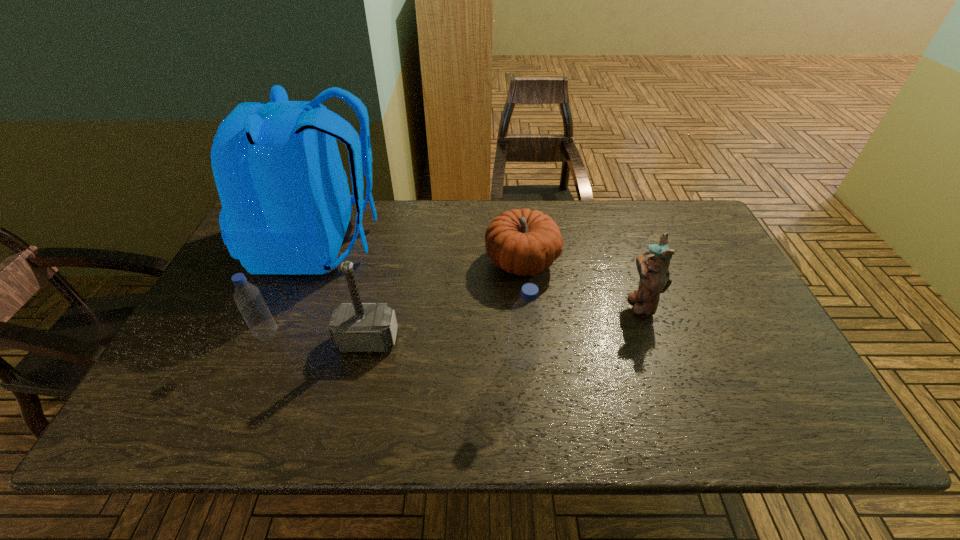
Locate an element on the screen. This screenshot has width=960, height=540. backpack situated at the left edge is located at coordinates click(x=286, y=205).

Where is `object positioned at the far left corner`? The height and width of the screenshot is (540, 960). object positioned at the far left corner is located at coordinates (286, 205).

Where is `vacant space at the far edge of the desktop`? This screenshot has width=960, height=540. vacant space at the far edge of the desktop is located at coordinates (646, 209).

In order to click on free region at the near edge of the desktop in this screenshot , I will do `click(578, 393)`.

Find the location of `free space at the far right corner`. free space at the far right corner is located at coordinates (660, 217).

The image size is (960, 540). In the image, there is a desktop. Identify the location of vacant space at the near right corner. (740, 397).

Locate an element on the screen. This screenshot has height=540, width=960. free spot between the tallest object and the shorter bottle is located at coordinates (294, 289).

The image size is (960, 540). Identify the location of empty location between the hammer and the nearer bottle. (445, 352).

The width and height of the screenshot is (960, 540). I want to click on free point between the figurine and the pumpkin, so click(x=581, y=284).

Where is `free area in between the pumpkin and the hammer`? The height and width of the screenshot is (540, 960). free area in between the pumpkin and the hammer is located at coordinates (444, 301).